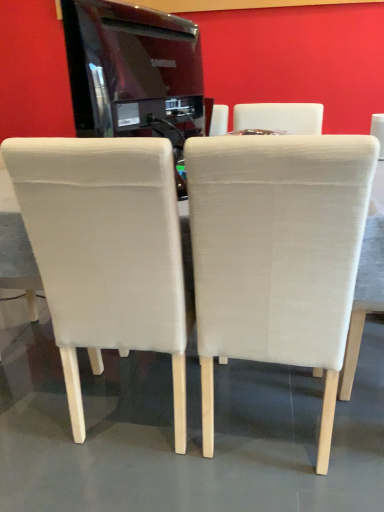
Question: Considering the relative positions of beige fabric chair at center, positioned as the second chair in right-to-left order, and white fabric table at center in the image provided, is beige fabric chair at center, positioned as the second chair in right-to-left order, to the right of white fabric table at center from the viewer's perspective?

Choices:
 (A) yes
 (B) no

Answer: (A)

Question: From the image's perspective, is beige fabric chair at center, which ranks as the 2th chair in left-to-right order, beneath white fabric table at center?

Choices:
 (A) yes
 (B) no

Answer: (A)

Question: From the image's perspective, is beige fabric chair at center, which ranks as the 2th chair in left-to-right order, on top of white fabric table at center?

Choices:
 (A) yes
 (B) no

Answer: (B)

Question: Can you confirm if beige fabric chair at center, which ranks as the 2th chair in left-to-right order, is thinner than white fabric table at center?

Choices:
 (A) no
 (B) yes

Answer: (B)

Question: Is beige fabric chair at center, positioned as the second chair in right-to-left order, closer to the viewer compared to white fabric table at center?

Choices:
 (A) yes
 (B) no

Answer: (A)

Question: Choose the correct answer: Is beige fabric chair at center, which is the first chair from left to right, inside beige fabric chair at center, positioned as the second chair in right-to-left order, or outside it?

Choices:
 (A) inside
 (B) outside

Answer: (B)

Question: Does point (137, 222) appear closer or farther from the camera than point (352, 276)?

Choices:
 (A) farther
 (B) closer

Answer: (A)

Question: Is beige fabric chair at center, the 3th chair in the right-to-left sequence, wider or thinner than beige fabric chair at center, which ranks as the 2th chair in left-to-right order?

Choices:
 (A) wide
 (B) thin

Answer: (A)

Question: From the image's perspective, is beige fabric chair at center, which is the first chair from left to right, located above or below beige fabric chair at center, positioned as the second chair in right-to-left order?

Choices:
 (A) above
 (B) below

Answer: (A)

Question: Considering the positions of white fabric table at center and beige fabric chair at center, which is the first chair from left to right, in the image, is white fabric table at center wider or thinner than beige fabric chair at center, which is the first chair from left to right,?

Choices:
 (A) thin
 (B) wide

Answer: (B)

Question: Does point (380, 280) appear closer or farther from the camera than point (79, 298)?

Choices:
 (A) farther
 (B) closer

Answer: (B)

Question: Is white fabric table at center taller or shorter than beige fabric chair at center, the 3th chair in the right-to-left sequence?

Choices:
 (A) short
 (B) tall

Answer: (A)

Question: Based on their sizes in the image, would you say white fabric table at center is bigger or smaller than beige fabric chair at center, which is the first chair from left to right?

Choices:
 (A) small
 (B) big

Answer: (B)

Question: In the image, is beige fabric chair at right, acting as the 1th chair starting from the right, on the left side or the right side of beige fabric chair at center, which ranks as the 2th chair in left-to-right order?

Choices:
 (A) right
 (B) left

Answer: (A)

Question: In terms of width, does beige fabric chair at right, the third chair from the left, look wider or thinner when compared to beige fabric chair at center, positioned as the second chair in right-to-left order?

Choices:
 (A) wide
 (B) thin

Answer: (B)